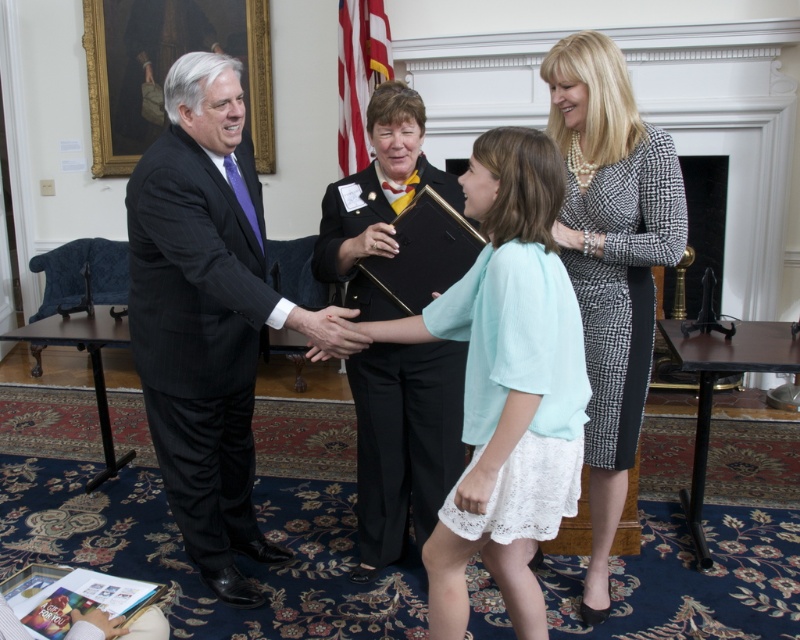
Does point (513, 616) come closer to viewer compared to point (356, 227)?

Yes, point (513, 616) is in front of point (356, 227).

Which is in front, point (500, 468) or point (362, 520)?

Point (500, 468) is in front.

This screenshot has width=800, height=640. Identify the location of light blue lace dress at center. (506, 384).

Does light blue lace dress at center appear over matte black book at center?

Actually, light blue lace dress at center is below matte black book at center.

Which is below, light blue lace dress at center or matte black book at center?

light blue lace dress at center is lower down.

Between point (474, 362) and point (382, 92), which one is positioned behind?

Point (382, 92)

This screenshot has height=640, width=800. What are the coordinates of `light blue lace dress at center` in the screenshot? It's located at (506, 384).

Is black pinstripe suit at left in front of matte black book at center?

Yes, it is in front of matte black book at center.

Who is shorter, black pinstripe suit at left or matte black book at center?

With less height is black pinstripe suit at left.

Does point (237, 499) come farther from viewer compared to point (612, 300)?

Yes.

The width and height of the screenshot is (800, 640). Find the location of `black pinstripe suit at left`. black pinstripe suit at left is located at coordinates (208, 316).